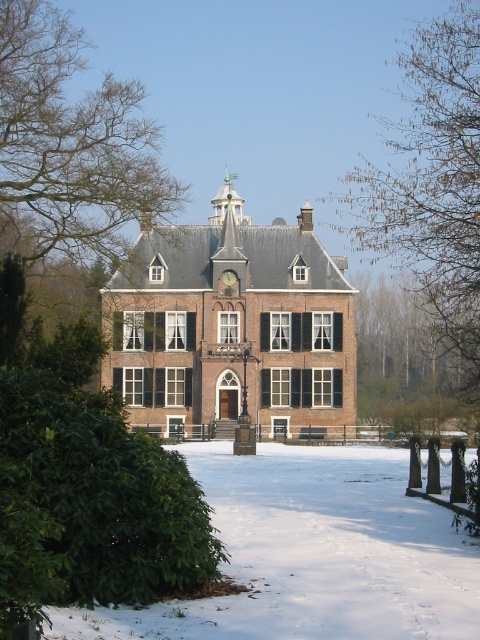
Question: Which point appears farthest from the camera in this image?

Choices:
 (A) (83, 452)
 (B) (223, 273)
 (C) (111, 140)
 (D) (465, 614)

Answer: (C)

Question: Does bare branches at left have a lesser width compared to gold metallic clock at center?

Choices:
 (A) no
 (B) yes

Answer: (A)

Question: Can you confirm if white powdery snow at lower center is positioned below gold metallic clock at center?

Choices:
 (A) no
 (B) yes

Answer: (B)

Question: Which of the following is the farthest from the observer?

Choices:
 (A) tap(240, 598)
 (B) tap(12, 76)
 (C) tap(384, 176)
 (D) tap(24, 534)

Answer: (C)

Question: In this image, where is bare branches at upper center located relative to gold metallic clock at center?

Choices:
 (A) below
 (B) above

Answer: (B)

Question: Which is nearer to the bare branches at left?

Choices:
 (A) gold metallic clock at center
 (B) green leafy bush at lower left

Answer: (A)